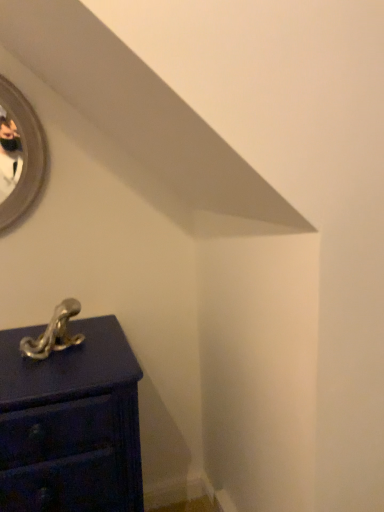
Locate an element on the screen. unoccupied area in front of polished silver hook at lower left is located at coordinates (43, 375).